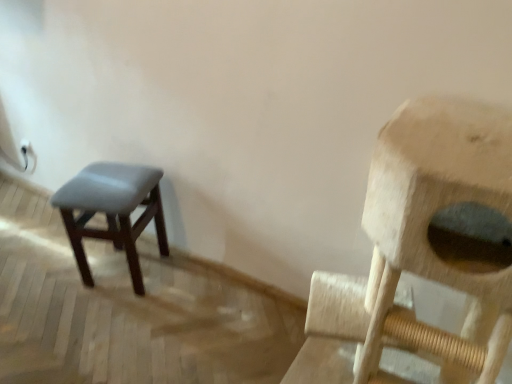
Question: Should I look upward or downward to see matte gray stool at left?

Choices:
 (A) up
 (B) down

Answer: (B)